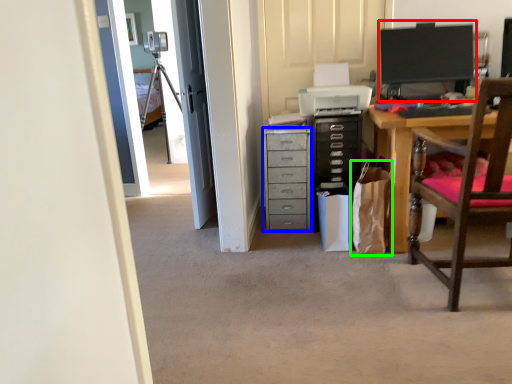
Question: Which is nearer to the computer monitor (highlighted by a red box)? chest of drawers (highlighted by a blue box) or shopping bag (highlighted by a green box).

Choices:
 (A) chest of drawers
 (B) shopping bag

Answer: (B)